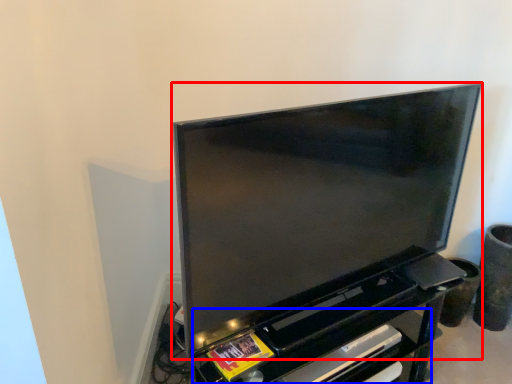
Question: Among these objects, which one is nearest to the camera, television (highlighted by a red box) or shelf (highlighted by a blue box)?

Choices:
 (A) television
 (B) shelf

Answer: (A)